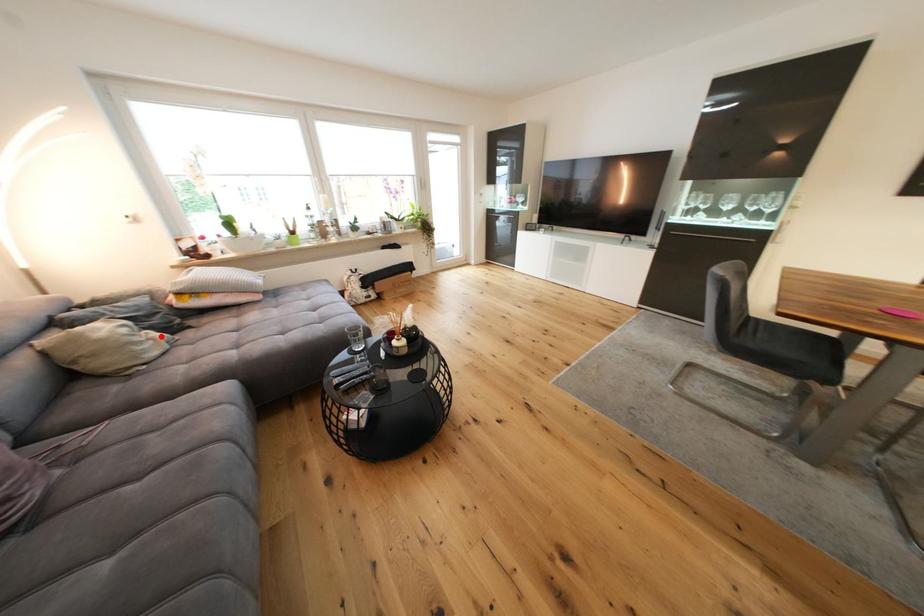
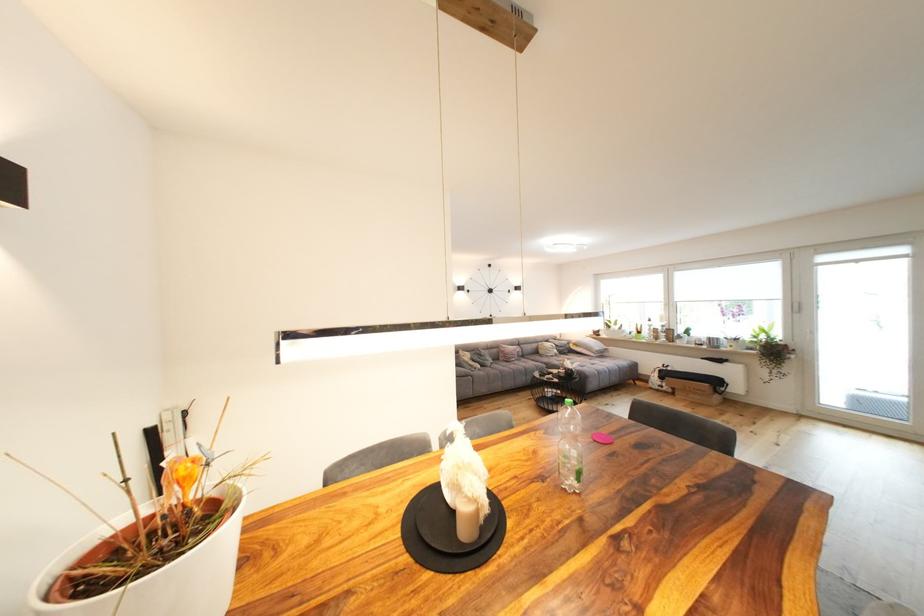
The point at the highlighted location is marked in the first image. Where is the corresponding point in the second image?

(563, 353)